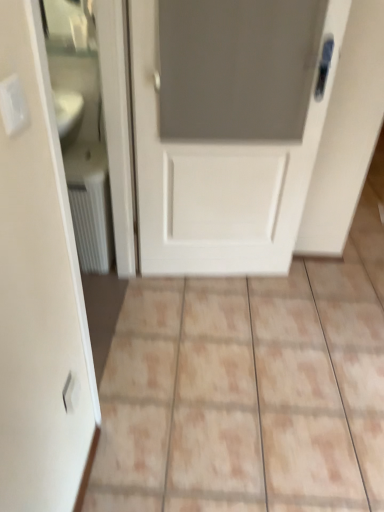
Question: Would you consider white plastic electric outlet at upper left, acting as the 2th electric outlet starting from the bottom, to be distant from white matte door at center?

Choices:
 (A) yes
 (B) no

Answer: (A)

Question: From a real-world perspective, is white plastic electric outlet at upper left, the second electric outlet viewed from the back, physically below white matte door at center?

Choices:
 (A) no
 (B) yes

Answer: (A)

Question: From the image's perspective, is white plastic electric outlet at upper left, acting as the 2th electric outlet starting from the bottom, beneath white matte door at center?

Choices:
 (A) yes
 (B) no

Answer: (A)

Question: Is white plastic electric outlet at upper left, the first electric outlet when ordered from front to back, positioned with its back to white matte door at center?

Choices:
 (A) yes
 (B) no

Answer: (B)

Question: Can you confirm if white plastic electric outlet at upper left, the first electric outlet when ordered from front to back, is thinner than white matte door at center?

Choices:
 (A) yes
 (B) no

Answer: (A)

Question: Does point (66, 384) appear closer or farther from the camera than point (76, 173)?

Choices:
 (A) farther
 (B) closer

Answer: (B)

Question: Is white plastic electric outlet at lower left, the first electric outlet ordered from the bottom, in front of or behind white textured radiator at left in the image?

Choices:
 (A) behind
 (B) front

Answer: (B)

Question: From the image's perspective, is white plastic electric outlet at lower left, the first electric outlet ordered from the bottom, positioned above or below white textured radiator at left?

Choices:
 (A) below
 (B) above

Answer: (A)

Question: From a real-world perspective, relative to white textured radiator at left, is white plastic electric outlet at lower left, the first electric outlet ordered from the bottom, vertically above or below?

Choices:
 (A) above
 (B) below

Answer: (A)

Question: From a real-world perspective, relative to white plastic electric outlet at lower left, the first electric outlet ordered from the bottom, is white plastic electric outlet at upper left, acting as the 1th electric outlet starting from the top, vertically above or below?

Choices:
 (A) below
 (B) above

Answer: (B)

Question: Choose the correct answer: Is white plastic electric outlet at upper left, the second electric outlet viewed from the back, inside white plastic electric outlet at lower left, acting as the 2th electric outlet starting from the front, or outside it?

Choices:
 (A) outside
 (B) inside

Answer: (A)

Question: Does point (3, 106) appear closer or farther from the camera than point (79, 384)?

Choices:
 (A) farther
 (B) closer

Answer: (B)

Question: Considering the relative positions of white plastic electric outlet at upper left, acting as the 2th electric outlet starting from the bottom, and white plastic electric outlet at lower left, which ranks as the second electric outlet in top-to-bottom order, in the image provided, is white plastic electric outlet at upper left, acting as the 2th electric outlet starting from the bottom, to the left or to the right of white plastic electric outlet at lower left, which ranks as the second electric outlet in top-to-bottom order,?

Choices:
 (A) left
 (B) right

Answer: (B)

Question: Considering the positions of white textured radiator at left and white plastic electric outlet at lower left, the first electric outlet viewed from the back, in the image, is white textured radiator at left taller or shorter than white plastic electric outlet at lower left, the first electric outlet viewed from the back,?

Choices:
 (A) short
 (B) tall

Answer: (B)

Question: Relative to white plastic electric outlet at lower left, the first electric outlet viewed from the back, is white textured radiator at left in front or behind?

Choices:
 (A) behind
 (B) front

Answer: (A)